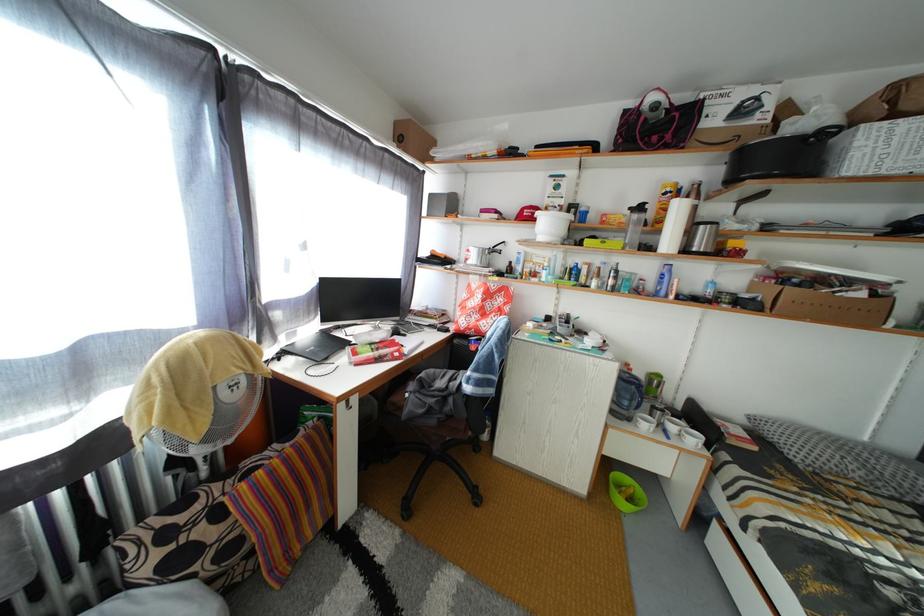
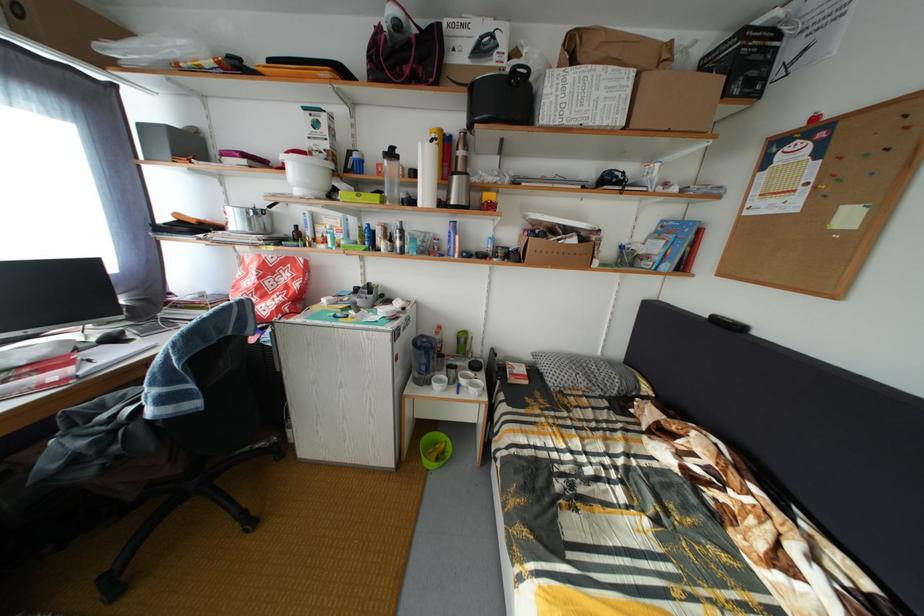
Where in the second image is the point corresponding to [613,225] from the first image?

(388, 176)